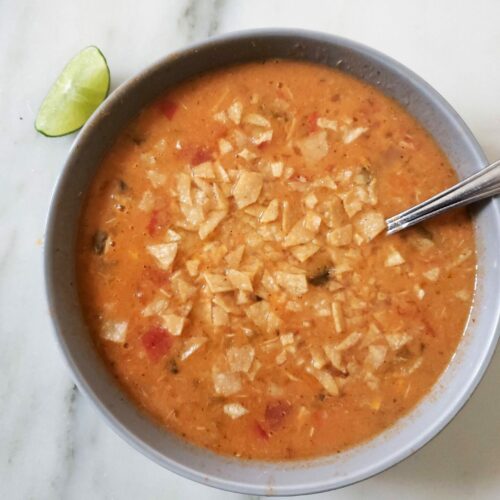
In order to click on grey bowl in this screenshot , I will do `click(447, 413)`.